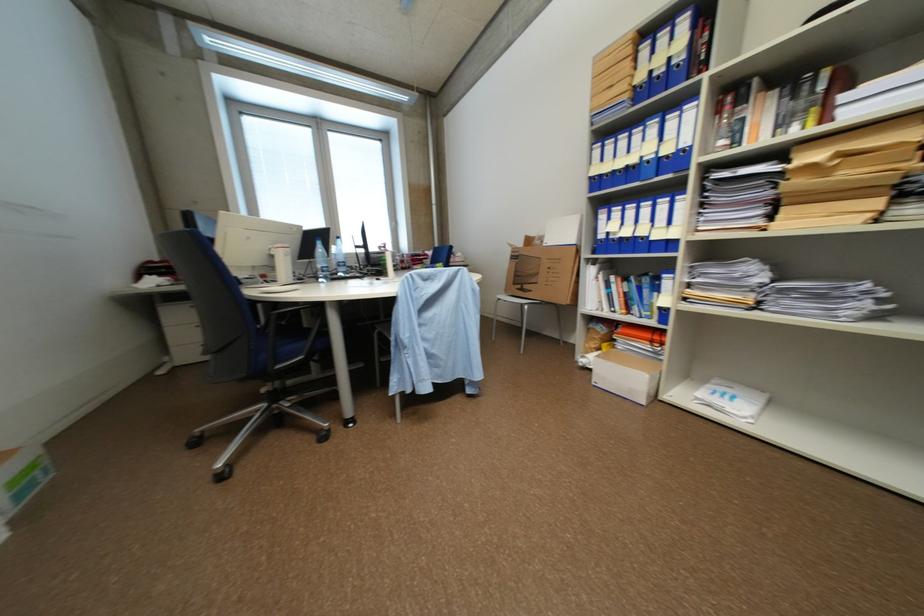
The width and height of the screenshot is (924, 616). Describe the element at coordinates (287, 310) in the screenshot. I see `a blue chair armrest` at that location.